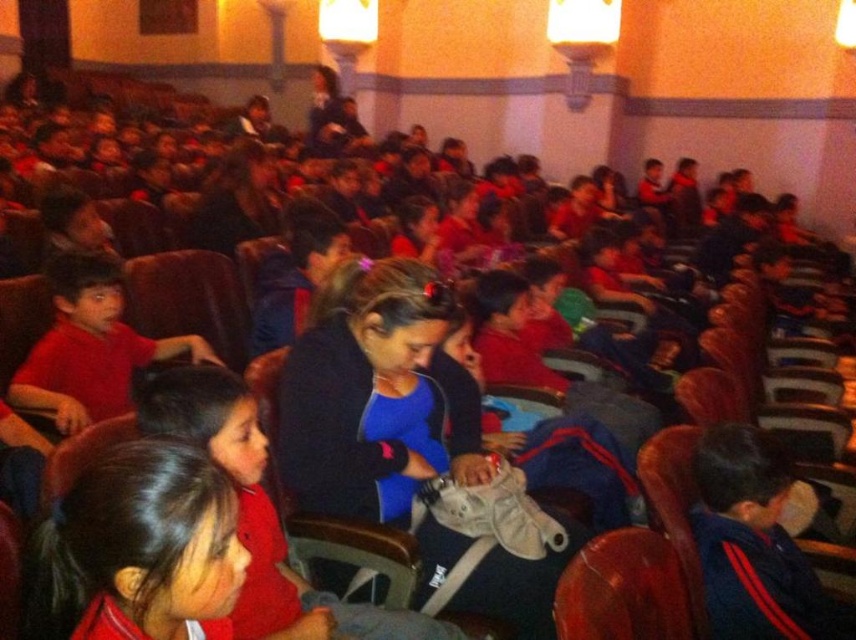
Question: From the image, what is the correct spatial relationship of matte red shirt at center in relation to blue fleece jacket at lower right?

Choices:
 (A) below
 (B) above

Answer: (B)

Question: Is matte red shirt at center above blue fleece jacket at lower right?

Choices:
 (A) yes
 (B) no

Answer: (A)

Question: Which point is farther to the camera?

Choices:
 (A) (183, 586)
 (B) (100, 296)
 (C) (696, 536)

Answer: (B)

Question: Which point is farther from the camera taking this photo?

Choices:
 (A) (734, 464)
 (B) (122, 412)
 (C) (64, 600)

Answer: (B)

Question: In this image, where is matte red shirt at center located relative to matte red shirt at left?

Choices:
 (A) below
 (B) above

Answer: (A)

Question: Which point is farther from the camera taking this photo?

Choices:
 (A) (68, 392)
 (B) (706, 570)

Answer: (A)